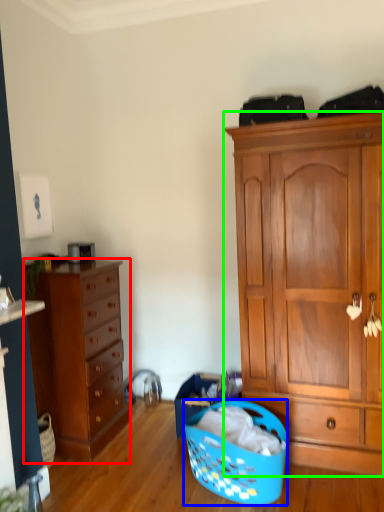
Question: Considering the real-world distances, which object is closest to chest of drawers (highlighted by a red box)? picnic basket (highlighted by a blue box) or cabinetry (highlighted by a green box).

Choices:
 (A) picnic basket
 (B) cabinetry

Answer: (A)